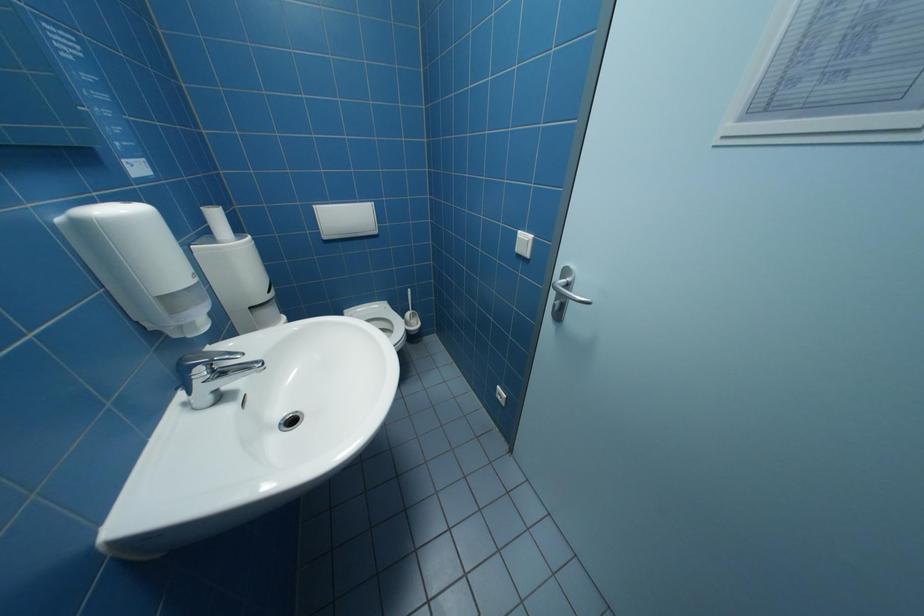
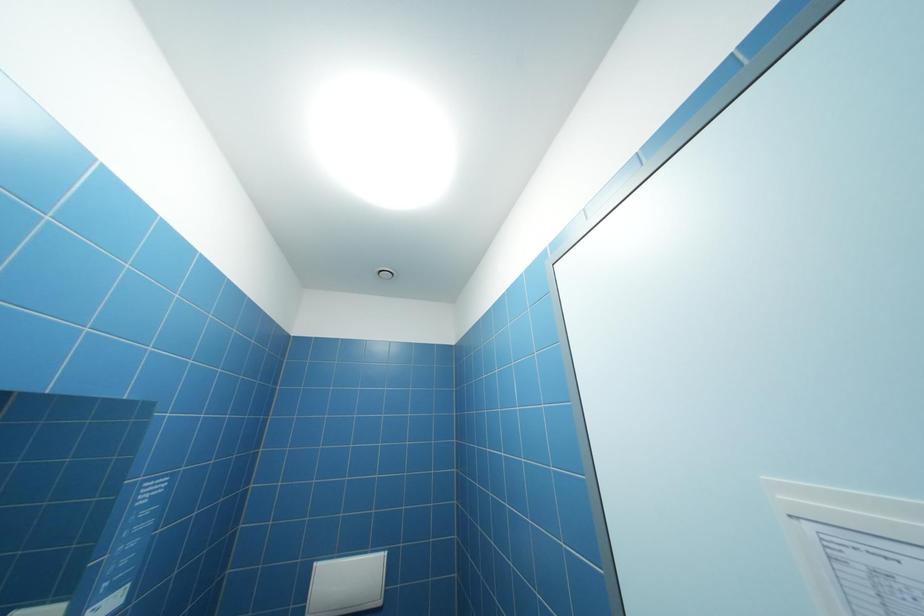
The first image is from the beginning of the video and the second image is from the end. How did the camera likely rotate when shooting the video?

The camera rotated toward left-up.